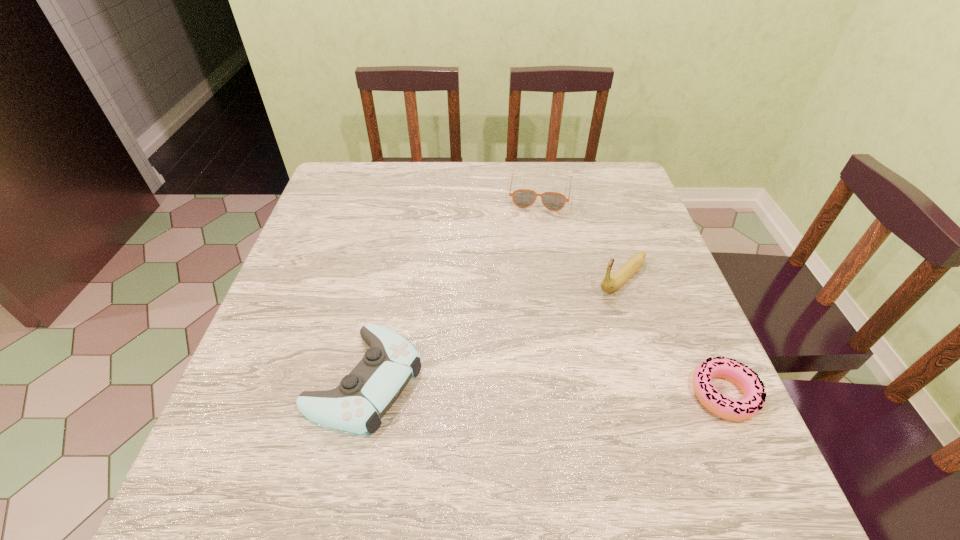
The width and height of the screenshot is (960, 540). I want to click on object that is at the near right corner, so point(745,378).

At what (x,y) coordinates should I click in order to perform the action: click on vacant space at the far edge of the desktop. Please return your answer as a coordinate pair (x, y). Looking at the image, I should click on (493, 168).

At what (x,y) coordinates should I click in order to perform the action: click on vacant space at the near edge. Please return your answer as a coordinate pair (x, y). This screenshot has width=960, height=540. Looking at the image, I should click on (417, 434).

Where is `free space at the left edge`? This screenshot has height=540, width=960. free space at the left edge is located at coordinates (332, 349).

At what (x,y) coordinates should I click in order to perform the action: click on vacant space at the right edge of the desktop. Please return your answer as a coordinate pair (x, y). Looking at the image, I should click on (621, 227).

In the image, there is a desktop. Where is `vacant space at the far right corner`? This screenshot has width=960, height=540. vacant space at the far right corner is located at coordinates (622, 199).

I want to click on empty space that is in between the tallest object and the farthest object, so click(581, 235).

Locate an element on the screen. The width and height of the screenshot is (960, 540). free space that is in between the doughnut and the farthest object is located at coordinates (632, 293).

This screenshot has width=960, height=540. Find the location of `vacant area between the doughnut and the leftmost object`. vacant area between the doughnut and the leftmost object is located at coordinates (544, 387).

Where is `free space between the shortest object and the tallest object`? free space between the shortest object and the tallest object is located at coordinates (673, 336).